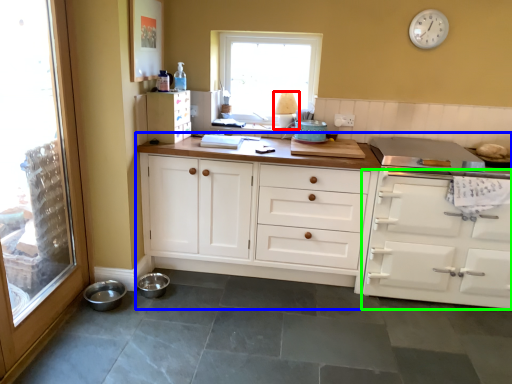
Question: Estimate the real-world distances between objects in this image. Which object is closer to lamp (highlighted by a red box), cabinetry (highlighted by a blue box) or cabinetry (highlighted by a green box)?

Choices:
 (A) cabinetry
 (B) cabinetry

Answer: (A)